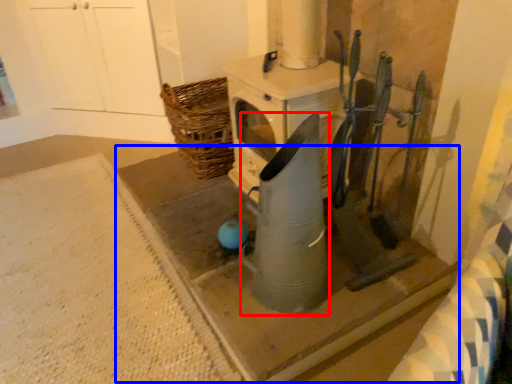
Question: Which of the following is the farthest to the observer, appliance (highlighted by a red box) or concrete (highlighted by a blue box)?

Choices:
 (A) appliance
 (B) concrete

Answer: (B)